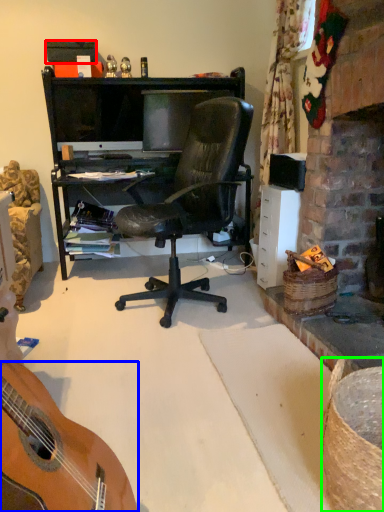
Question: Based on their relative distances, which object is farther from box (highlighted by a red box)? Choose from guitar (highlighted by a blue box) and picnic basket (highlighted by a green box).

Choices:
 (A) guitar
 (B) picnic basket

Answer: (B)